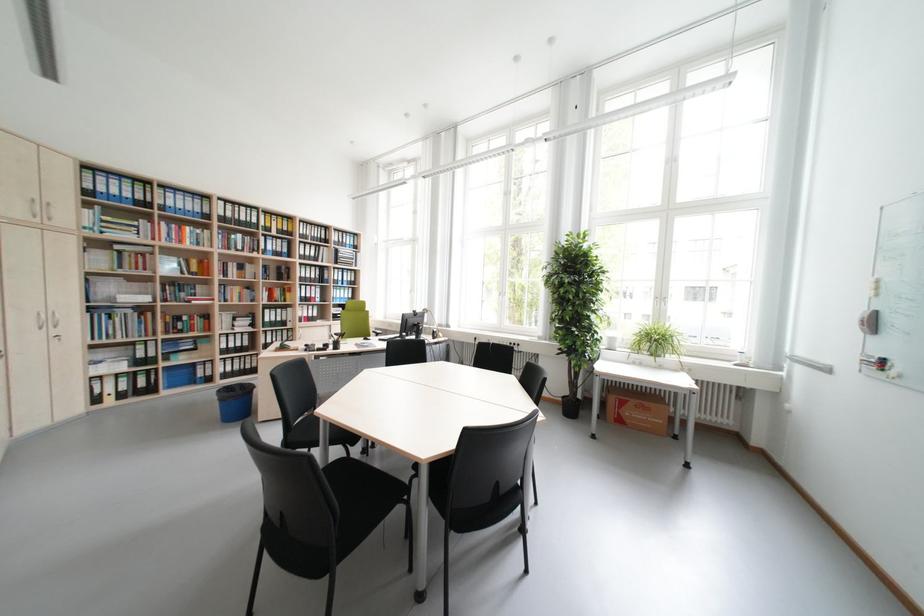
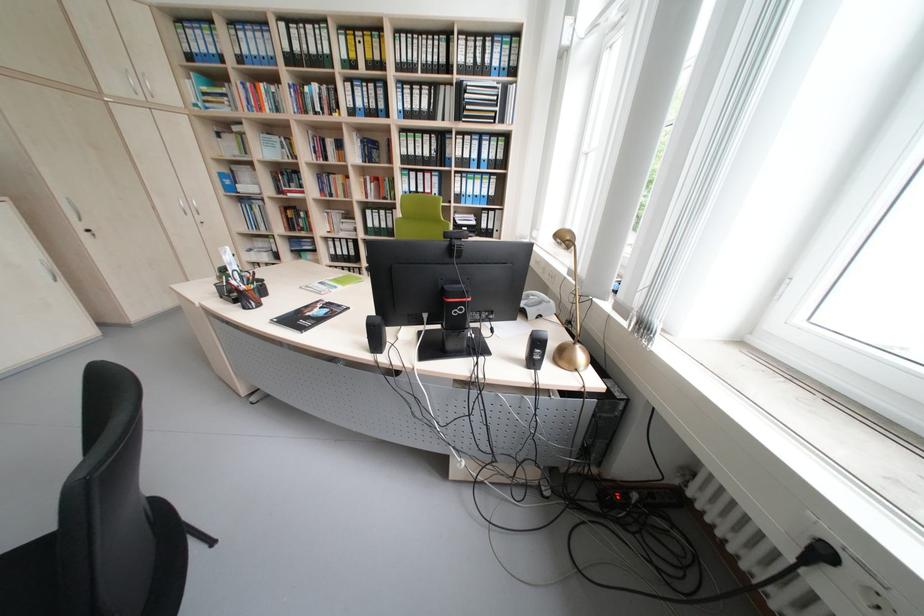
The point at (485, 339) is marked in the first image. Where is the corresponding point in the second image?

(833, 554)